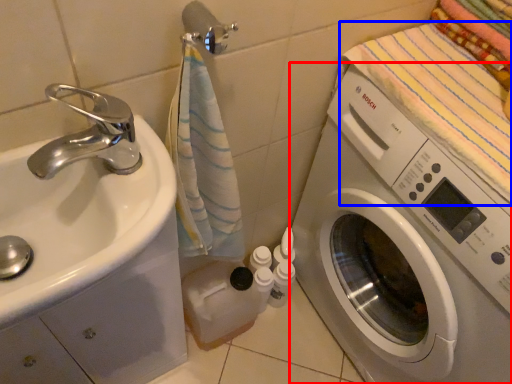
Question: Among these objects, which one is farthest to the camera, washing machine (highlighted by a red box) or beach towel (highlighted by a blue box)?

Choices:
 (A) washing machine
 (B) beach towel

Answer: (B)